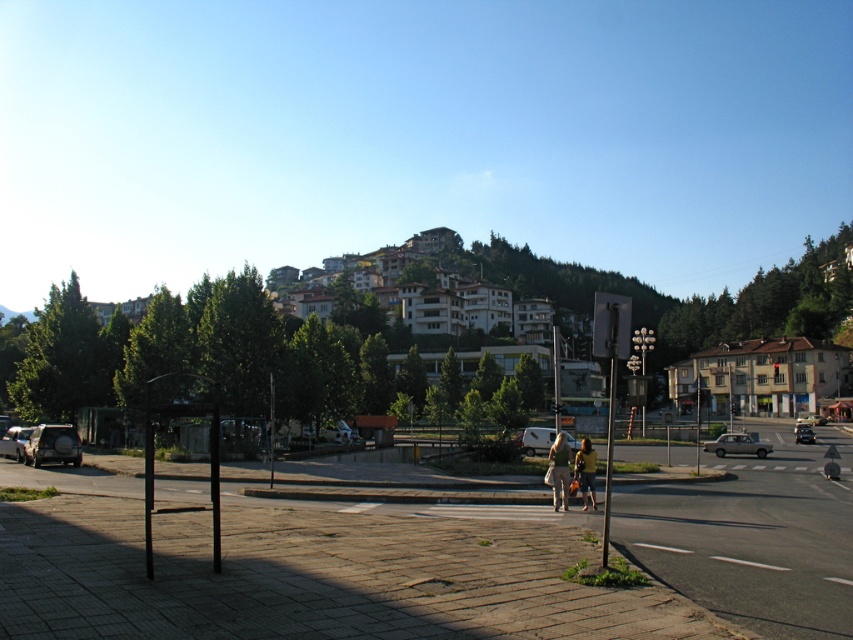
You are standing at the edge of the plaza in the small town. You see a yellow fabric bag at center and a silver metallic van at center. How far apart are these two items?

The yellow fabric bag at center is 19.42 meters away from the silver metallic van at center.

You are standing at the center of the plaza and want to walk to the nearest point between point A at point [593,499] and point B at point [537,435]. Which point should you walk towards?

You should walk towards point A at point [593,499] because it is closer to you than point B at point [537,435].